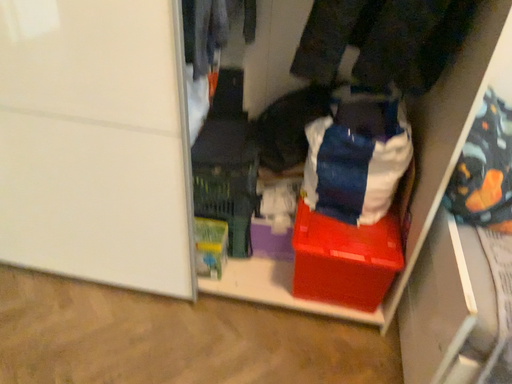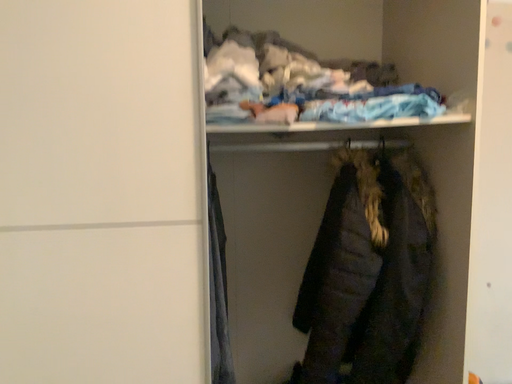
Question: Which way did the camera rotate in the video?

Choices:
 (A) rotated right
 (B) rotated left

Answer: (A)